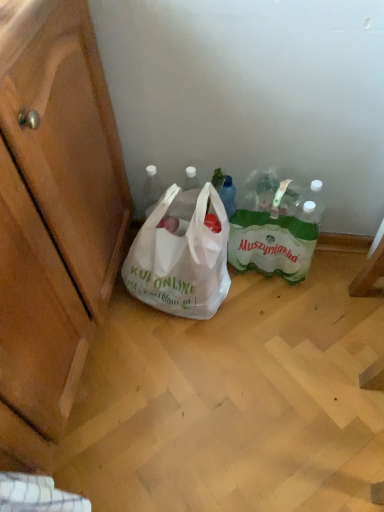
The image size is (384, 512). In order to click on vacant area to the right of white plastic bag at center in this screenshot , I will do `click(260, 310)`.